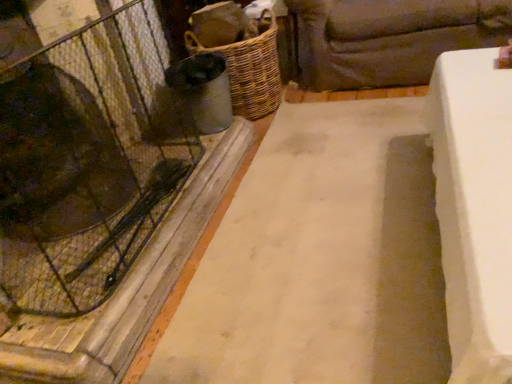
Measure the distance between transparent glass door at left and camera.

transparent glass door at left is 39.15 inches from camera.

The image size is (512, 384). Describe the element at coordinates (389, 38) in the screenshot. I see `dark brown fabric couch at upper right` at that location.

Describe the element at coordinates (249, 70) in the screenshot. I see `woven brown basket at center-left` at that location.

Identify the location of transparent glass door at left. (87, 160).

Which object is closer to the camera taking this photo, dark brown fabric couch at upper right or transparent glass door at left?

Positioned in front is transparent glass door at left.

From the image's perspective, who appears lower, dark brown fabric couch at upper right or transparent glass door at left?

transparent glass door at left.

How different are the orientations of dark brown fabric couch at upper right and transparent glass door at left in degrees?

The facing directions of dark brown fabric couch at upper right and transparent glass door at left are 88.2 degrees apart.

Which of these two, dark brown fabric couch at upper right or transparent glass door at left, is smaller?

transparent glass door at left is smaller.

Considering the sizes of transparent glass door at left and white concrete slab at center in the image, is transparent glass door at left bigger or smaller than white concrete slab at center?

Clearly, transparent glass door at left is smaller in size than white concrete slab at center.

Based on the photo, from the image's perspective, between transparent glass door at left and white concrete slab at center, who is located below?

transparent glass door at left.

From a real-world perspective, is transparent glass door at left above or below white concrete slab at center?

transparent glass door at left is above white concrete slab at center.

Is woven brown basket at center-left at the back of dark brown fabric couch at upper right?

No, dark brown fabric couch at upper right's orientation is not away from woven brown basket at center-left.

Can you tell me how much dark brown fabric couch at upper right and woven brown basket at center-left differ in facing direction?

They differ by 88.9 degrees in their facing directions.

Considering the relative sizes of dark brown fabric couch at upper right and woven brown basket at center-left in the image provided, is dark brown fabric couch at upper right bigger than woven brown basket at center-left?

Yes, dark brown fabric couch at upper right is bigger than woven brown basket at center-left.

Considering the positions of objects dark brown fabric couch at upper right and woven brown basket at center-left in the image provided, who is in front, dark brown fabric couch at upper right or woven brown basket at center-left?

dark brown fabric couch at upper right.

Which is more distant, (248, 111) or (364, 371)?

The point (248, 111) is more distant.

Is woven brown basket at center-left taller than white concrete slab at center?

Yes, woven brown basket at center-left is taller than white concrete slab at center.

From a real-world perspective, which object rests below the other?

In real-world perspective, white concrete slab at center is lower.

Are woven brown basket at center-left and white concrete slab at center located far from each other?

No, woven brown basket at center-left is in close proximity to white concrete slab at center.

Is woven brown basket at center-left oriented towards dark brown fabric couch at upper right?

No, woven brown basket at center-left is not turned towards dark brown fabric couch at upper right.

Can you see woven brown basket at center-left touching dark brown fabric couch at upper right?

No, woven brown basket at center-left is not in contact with dark brown fabric couch at upper right.

Considering the positions of points (259, 101) and (430, 56), is point (259, 101) closer to camera compared to point (430, 56)?

No, (259, 101) is further to viewer.

From a real-world perspective, relative to dark brown fabric couch at upper right, is woven brown basket at center-left vertically above or below?

Clearly, from a real-world perspective, woven brown basket at center-left is above dark brown fabric couch at upper right.

What's the angular difference between transparent glass door at left and dark brown fabric couch at upper right's facing directions?

The angular difference between transparent glass door at left and dark brown fabric couch at upper right is 88.2 degrees.

Is the position of transparent glass door at left more distant than that of dark brown fabric couch at upper right?

No, transparent glass door at left is in front of dark brown fabric couch at upper right.

Which of these two, transparent glass door at left or dark brown fabric couch at upper right, is smaller?

Smaller between the two is transparent glass door at left.

Is transparent glass door at left taller than dark brown fabric couch at upper right?

Correct, transparent glass door at left is much taller as dark brown fabric couch at upper right.

In terms of height, does dark brown fabric couch at upper right look taller or shorter compared to white concrete slab at center?

In the image, dark brown fabric couch at upper right appears to be taller than white concrete slab at center.

Is dark brown fabric couch at upper right not within white concrete slab at center?

Yes, dark brown fabric couch at upper right is located beyond the bounds of white concrete slab at center.

There is a white concrete slab at center. Where is `studio couch above it (from a real-world perspective)`? This screenshot has width=512, height=384. studio couch above it (from a real-world perspective) is located at coordinates [389, 38].

Find the location of a particular element. studio couch below the transparent glass door at left (from a real-world perspective) is located at coordinates point(389,38).

This screenshot has height=384, width=512. I want to click on glass door on the left side of white concrete slab at center, so click(87, 160).

Which object lies nearer to the anchor point dark brown fabric couch at upper right, transparent glass door at left or woven brown basket at center-left?

woven brown basket at center-left lies closer to dark brown fabric couch at upper right than the other object.

From the image, which object appears to be farther from transparent glass door at left, white concrete slab at center or woven brown basket at center-left?

woven brown basket at center-left is positioned further to the anchor transparent glass door at left.

In the scene shown: Which object lies further to the anchor point dark brown fabric couch at upper right, white concrete slab at center or woven brown basket at center-left?

white concrete slab at center is further to dark brown fabric couch at upper right.

Based on their spatial positions, is woven brown basket at center-left or transparent glass door at left further from white concrete slab at center?

The object further to white concrete slab at center is woven brown basket at center-left.

Looking at the image, which one is located closer to transparent glass door at left, dark brown fabric couch at upper right or white concrete slab at center?

white concrete slab at center is positioned closer to the anchor transparent glass door at left.

When comparing their distances from white concrete slab at center, does dark brown fabric couch at upper right or woven brown basket at center-left seem closer?

woven brown basket at center-left is closer to white concrete slab at center.

Estimate the real-world distances between objects in this image. Which object is further from dark brown fabric couch at upper right, woven brown basket at center-left or transparent glass door at left?

transparent glass door at left is further to dark brown fabric couch at upper right.

Consider the image. Considering their positions, is transparent glass door at left positioned closer to white concrete slab at center than woven brown basket at center-left?

transparent glass door at left is positioned closer to the anchor white concrete slab at center.

I want to click on basket situated between transparent glass door at left and dark brown fabric couch at upper right from left to right, so click(x=249, y=70).

You are a GUI agent. You are given a task and a screenshot of the screen. Output one action in this format:
    pyautogui.click(x=<x>, y=<y>)
    Task: Click on the foundation located between transparent glass door at left and dark brown fabric couch at upper right in the left-right direction
    
    Given the screenshot: What is the action you would take?
    pyautogui.click(x=320, y=260)

Where is `studio couch positioned between white concrete slab at center and woven brown basket at center-left from near to far`? The image size is (512, 384). studio couch positioned between white concrete slab at center and woven brown basket at center-left from near to far is located at coordinates (x=389, y=38).

In order to click on glass door between white concrete slab at center and woven brown basket at center-left along the z-axis in this screenshot , I will do `click(87, 160)`.